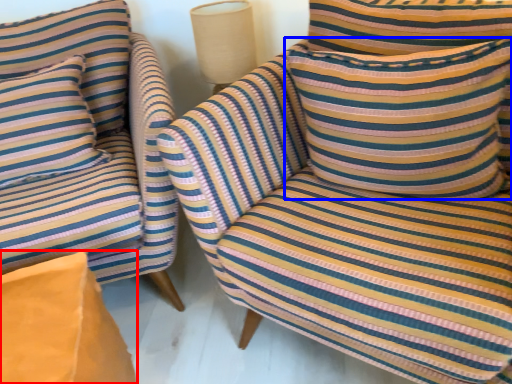
Question: Which object is closer to the camera taking this photo, cardboard box (highlighted by a red box) or pillow (highlighted by a blue box)?

Choices:
 (A) cardboard box
 (B) pillow

Answer: (A)